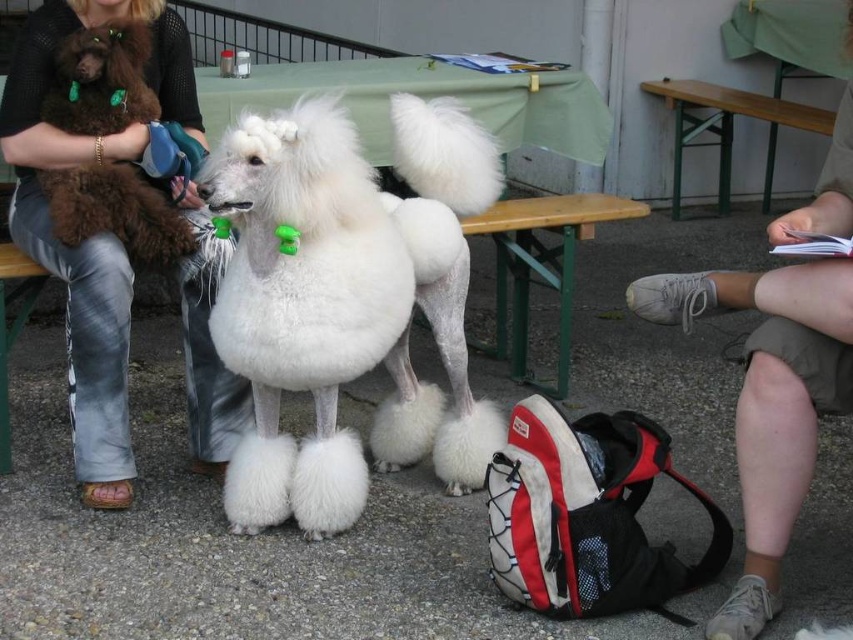
You are a photographer at the event and want to capture a photo of the white fluffy dog at center and the green painted wood picnic table at upper right. Which object is taller?

The white fluffy dog at center is much taller than the green painted wood picnic table at upper right.

Based on the photo, you are a photographer at the event and need to capture a photo that includes both the white fluffy dog at center and the light brown shorts at lower right. Based on their sizes, which object should you position closer to the camera to ensure both fit in the frame?

The white fluffy dog at center is wider than the light brown shorts at lower right. To ensure both fit in the frame, position the white fluffy dog at center closer to the camera since its larger size requires more space in the photo.

You are a photographer at the event and need to decide which dog to focus on for a closeup shot. Since the white fluffy dog at center is bigger than the light brown shorts at lower right, which dog should you choose to ensure the subject fills the frame better?

The white fluffy dog at center has a larger size compared to light brown shorts at lower right, so choosing the white fluffy dog at center will ensure the subject fills the frame better.